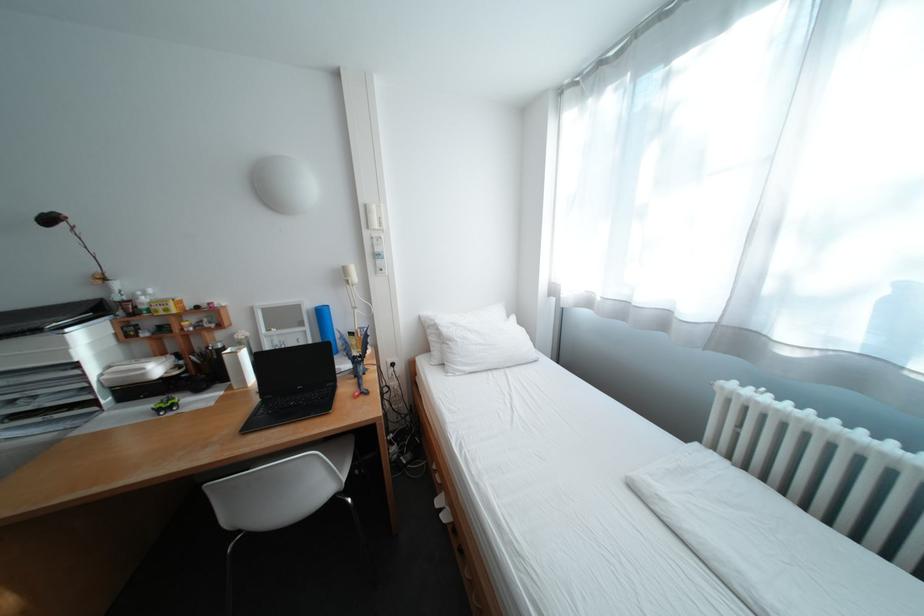
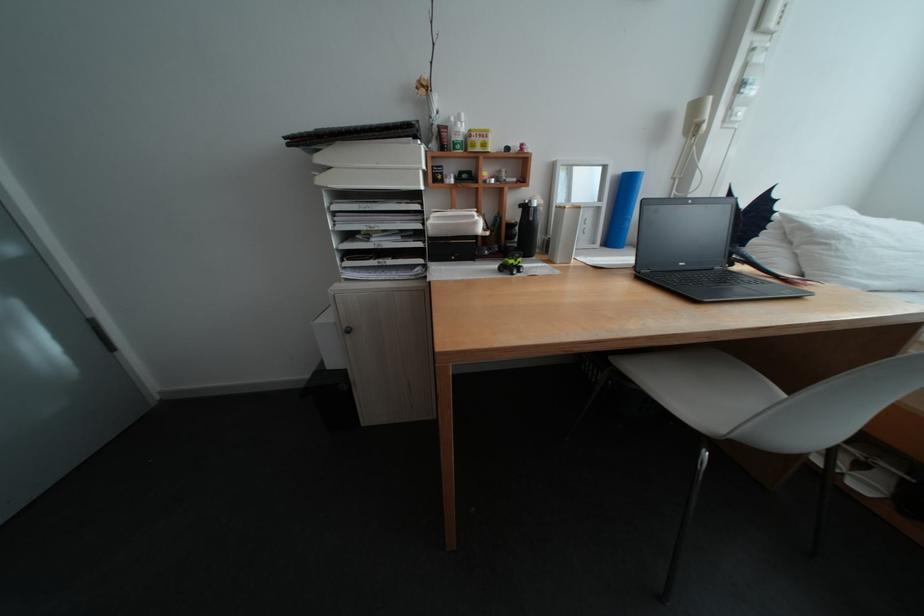
Locate, in the second image, the point that corresponds to the point at 168,411 in the first image.

(511, 272)